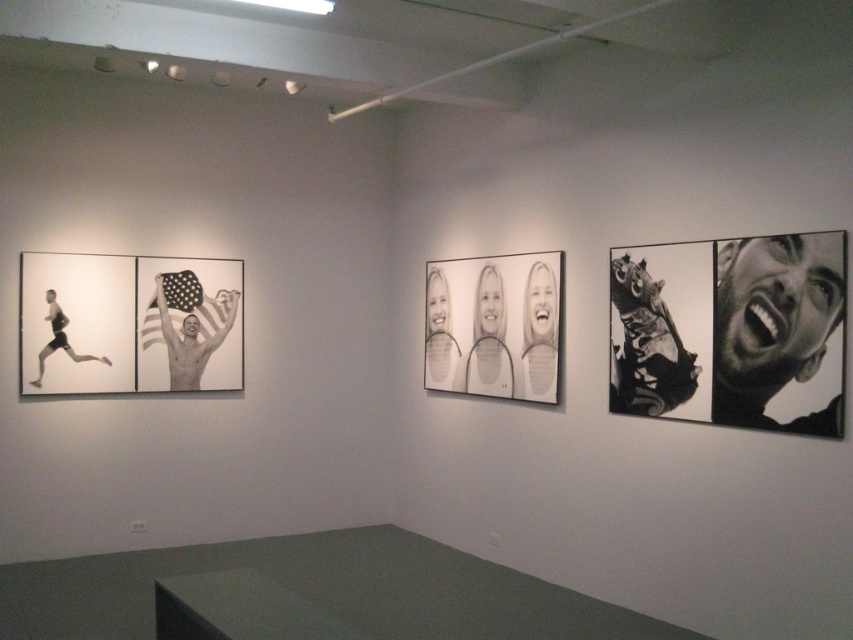
You are standing in the art gallery and want to touch both points on the wall. Which point should you reach for first, the point at coordinate (531, 342) or the point at coordinate (672, 384)?

You should reach for the point at coordinate (531, 342) first because it is closer to you than the point at coordinate (672, 384).

You are standing in the art gallery and want to know how far the point at coordinates (614, 380) is from you. Can you determine the distance?

The point at coordinates (614, 380) is 15.18 feet away from the viewer.

You are an art curator planning to hang a new painting in the art gallery. The current layout has a point at coordinates (x=495, y=324). Which artwork is this point located on?

The point at coordinates (x=495, y=324) is located on the black and white photograph of three smiling faces at center.